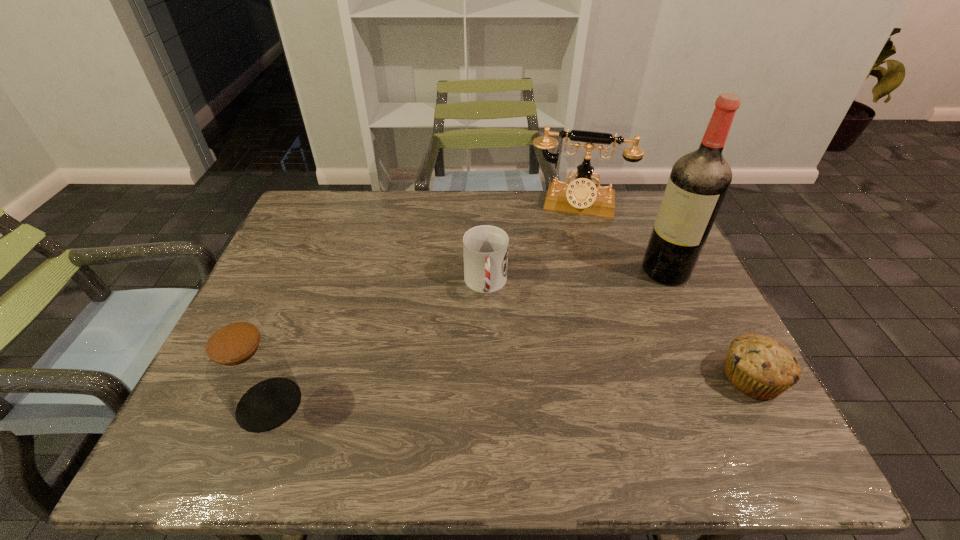
Image resolution: width=960 pixels, height=540 pixels. In order to click on vacant space located on the front-facing side of the tallest object in this screenshot , I will do `click(618, 298)`.

The width and height of the screenshot is (960, 540). I want to click on vacant point located on the front-facing side of the tallest object, so click(x=564, y=329).

The image size is (960, 540). In order to click on free space located 0.210m on the front-facing side of the tallest object in this screenshot , I will do `click(593, 312)`.

In order to click on vacant space located on the side of the fourth tallest object where the handle is located in this screenshot , I will do `click(493, 389)`.

Identify the location of vacant position located 0.280m on the side of the fourth tallest object where the handle is located. This screenshot has width=960, height=540. (494, 406).

I want to click on vacant space located 0.160m on the side of the fourth tallest object where the handle is located, so click(x=491, y=359).

Locate an element on the screen. This screenshot has height=540, width=960. vacant space located 0.250m on the dial of the farthest object is located at coordinates (563, 270).

Locate an element on the screen. free space located on the dial of the farthest object is located at coordinates (561, 277).

The width and height of the screenshot is (960, 540). Find the location of `free point located 0.140m on the dial of the farthest object`. free point located 0.140m on the dial of the farthest object is located at coordinates (565, 246).

You are a GUI agent. You are given a task and a screenshot of the screen. Output one action in this format:
    pyautogui.click(x=<x>, y=<y>)
    Task: Click on the object that is at the far edge
    The height and width of the screenshot is (540, 960).
    Given the screenshot: What is the action you would take?
    pyautogui.click(x=581, y=196)